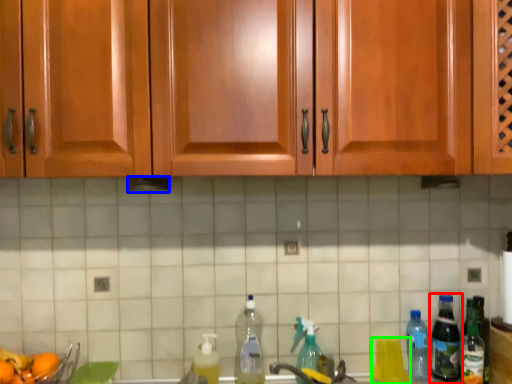
Question: Which object is positioned closest to bottle (highlighted by a red box)? Select from exhaust hood (highlighted by a blue box) and bottle (highlighted by a green box).

Choices:
 (A) exhaust hood
 (B) bottle

Answer: (B)